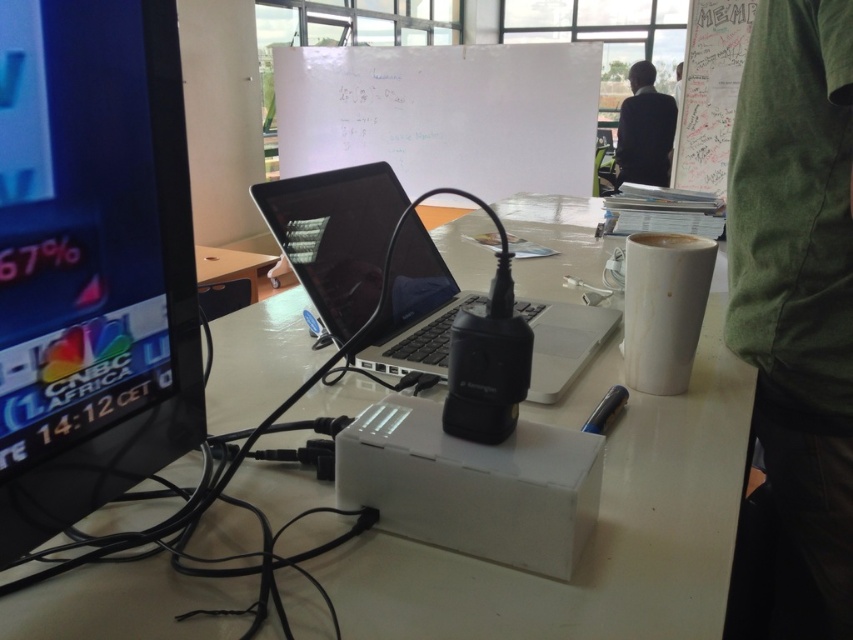
Question: Which object is closer to the camera taking this photo?

Choices:
 (A) sleek black laptop at center
 (B) white plastic table at center

Answer: (B)

Question: Is sleek black laptop at center thinner than white matte cup at upper right?

Choices:
 (A) no
 (B) yes

Answer: (A)

Question: Is white plastic table at center thinner than matte black monitor at left?

Choices:
 (A) yes
 (B) no

Answer: (B)

Question: Which of the following is the farthest from the observer?

Choices:
 (A) white matte cup at upper right
 (B) white plastic table at center
 (C) matte black monitor at left
 (D) black fabric jacket at upper right

Answer: (D)

Question: Which object is positioned closest to the black fabric jacket at upper right?

Choices:
 (A) sleek black laptop at center
 (B) white matte cup at upper right

Answer: (A)

Question: Where is white plastic table at center located in relation to green cotton shirt at upper right in the image?

Choices:
 (A) below
 (B) above

Answer: (B)